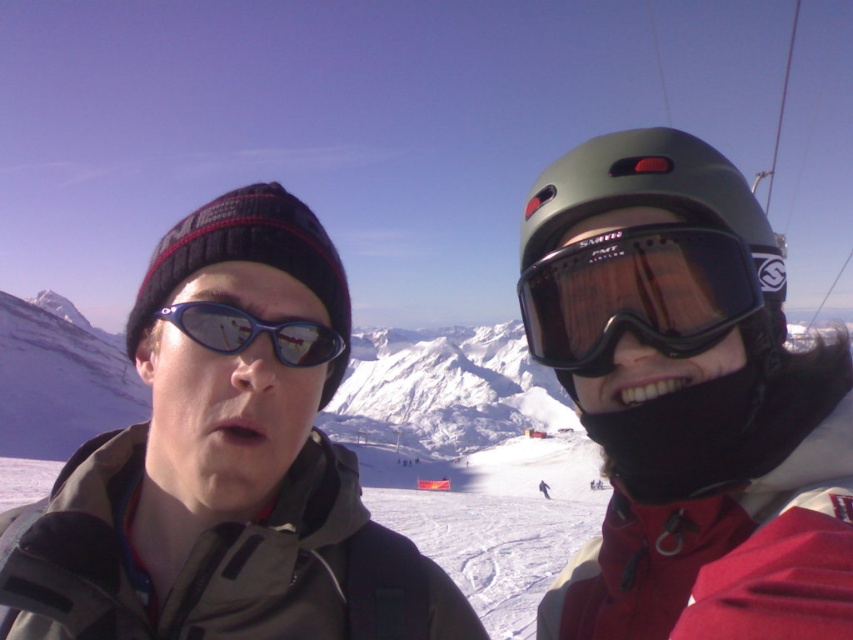
You are standing at the base of the mountain and see the point marked as point (570, 272) on the slope. You need to place a safety flag there. If the flag pole is 10 feet tall, will the top of the flag pole be visible from your current position?

The point (570, 272) is 229.85 feet away from viewer. Since the flag pole is only 10 feet tall, the top of the flag pole will not be visible from your current position due to the distance and possible terrain obstruction.

You are standing at the base of the mountain and see the black matte goggles at upper right. If you want to throw a snowball to hit the goggles, considering the distance is 65.55 meters, is it possible for you to do so?

The black matte goggles at upper right are 65.55 meters away from the viewer. Depending on your strength and aim, it might be challenging but possible to throw a snowball that far. However, accuracy could be an issue due to the distance.